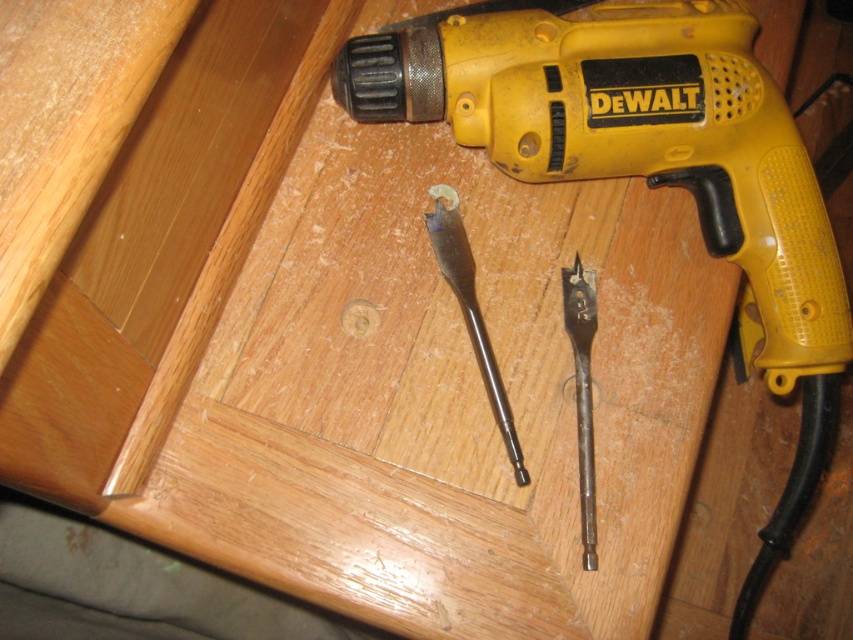
Looking at this image, you are a carpenter trying to reach the black metal drill bit at center from your current position near the yellow plastic drill at upper right. Which object is closer to you?

The yellow plastic drill at upper right is closer to you since it is further to the viewer than the black metal drill bit at center.

You are a carpenter working on a project and need to know the position of your tools. Given the scene, is the yellow plastic drill at upper right positioned above or below the matte metal drill bit at center?

The yellow plastic drill at upper right is located below the matte metal drill bit at center according to the description.

You are a carpenter trying to organize your tools. You have a yellow plastic drill at upper right and a black metal drill bit at center on your workbench. If you want to place both items side by side in a storage compartment, which one requires more horizontal space?

The yellow plastic drill at upper right requires more horizontal space because its width surpasses that of the black metal drill bit at center.